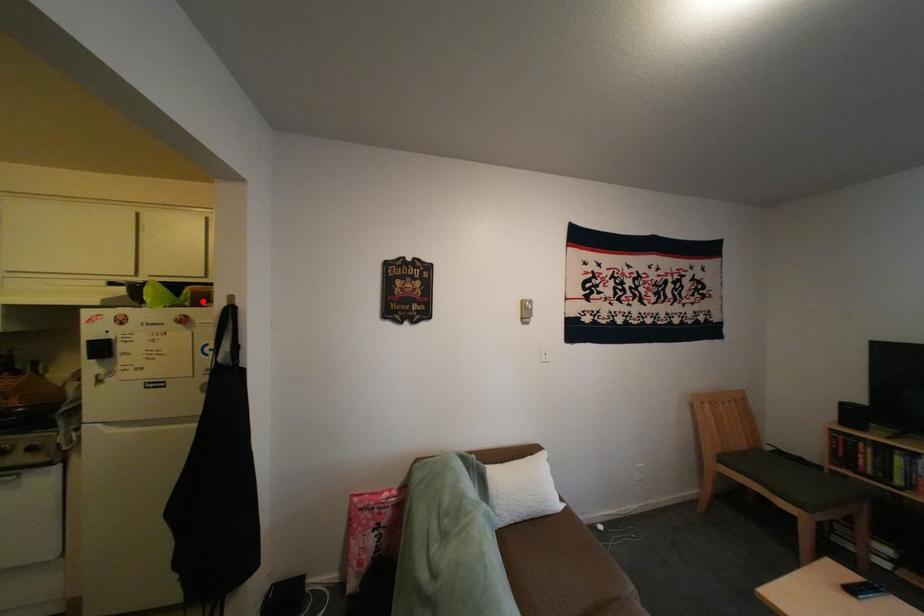
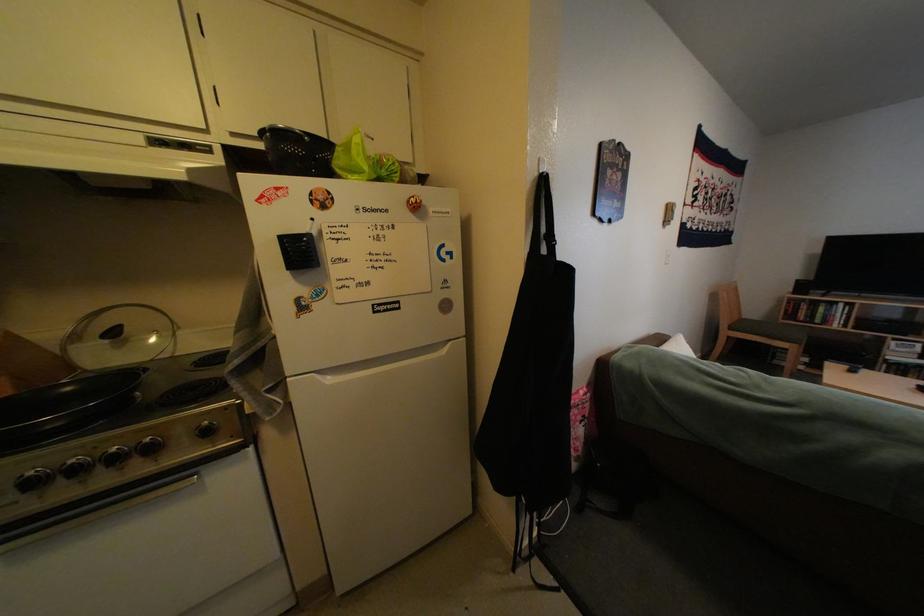
Find the pixel in the second image that matches the highlighted location in the first image.

(412, 176)